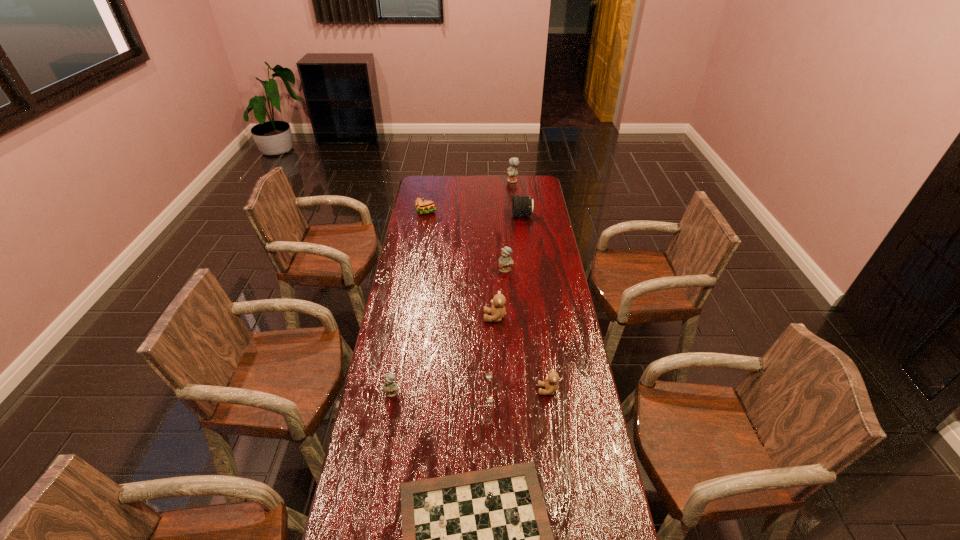
This screenshot has height=540, width=960. Identify the location of sandwich that is at the left edge. (423, 206).

You are a GUI agent. You are given a task and a screenshot of the screen. Output one action in this format:
    pyautogui.click(x=<x>, y=<y>)
    Task: Click on the teddy bear that is positioned at the left edge
    This screenshot has width=960, height=540.
    Given the screenshot: What is the action you would take?
    pyautogui.click(x=390, y=387)

Locate an element on the screen. The width and height of the screenshot is (960, 540). telephoto lens located at the right edge is located at coordinates (521, 205).

I want to click on object at the far right corner, so click(x=512, y=171).

Where is `vacant area at the far edge`? The image size is (960, 540). vacant area at the far edge is located at coordinates (474, 188).

You are a GUI agent. You are given a task and a screenshot of the screen. Output one action in this format:
    pyautogui.click(x=<x>, y=<y>)
    Task: Click on the vacant space at the left edge of the desktop
    Image resolution: width=960 pixels, height=540 pixels.
    Given the screenshot: What is the action you would take?
    pyautogui.click(x=429, y=249)

In the image, there is a desktop. Where is `vacant area at the right edge`? This screenshot has width=960, height=540. vacant area at the right edge is located at coordinates (531, 256).

In the image, there is a desktop. Where is `vacant area at the far right corner`? This screenshot has height=540, width=960. vacant area at the far right corner is located at coordinates (535, 189).

I want to click on empty location between the sandwich and the left brown teddy bear, so click(x=460, y=265).

Identify the location of vacant area between the bigger brown teddy bear and the sandwich. (460, 265).